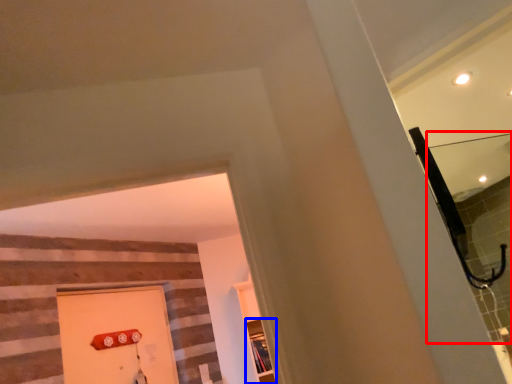
Question: Among these objects, which one is farthest to the camera, mirror (highlighted by a red box) or shelf (highlighted by a blue box)?

Choices:
 (A) mirror
 (B) shelf

Answer: (B)